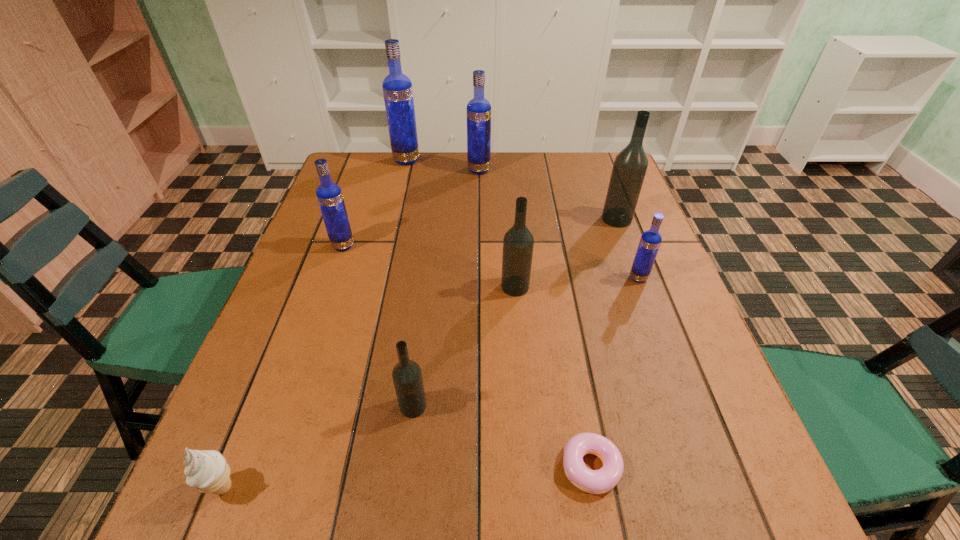
The width and height of the screenshot is (960, 540). Identify the location of the rightmost blue vodka. (650, 241).

Where is `the smallest blue vodka`? This screenshot has width=960, height=540. the smallest blue vodka is located at coordinates (650, 241).

This screenshot has height=540, width=960. Identify the location of the smallest black vodka. (407, 377).

Locate an element on the screen. The width and height of the screenshot is (960, 540). the leftmost black vodka is located at coordinates (407, 377).

At what (x,y) coordinates should I click in order to perform the action: click on the second shortest object. Please return your answer as a coordinate pair (x, y). Looking at the image, I should click on (207, 470).

Locate an element on the screen. This screenshot has height=540, width=960. the leftmost object is located at coordinates (207, 470).

The image size is (960, 540). Identify the location of doughnut. (600, 481).

This screenshot has height=540, width=960. I want to click on the seventh object from left to right, so click(600, 481).

The height and width of the screenshot is (540, 960). In order to click on free space located 0.380m on the right of the second vodka from left to right in this screenshot , I will do `click(537, 160)`.

Where is `vacant space located 0.370m on the front of the third blue vodka from left to right`? vacant space located 0.370m on the front of the third blue vodka from left to right is located at coordinates [479, 254].